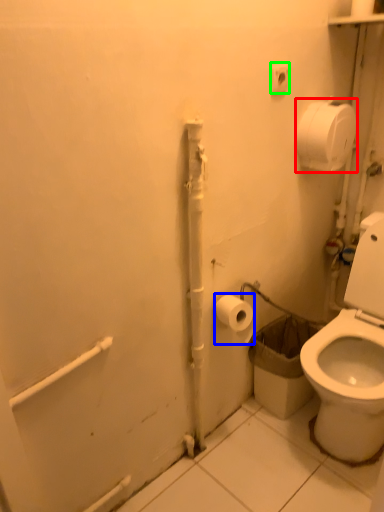
Question: Estimate the real-world distances between objects in this image. Which object is closer to toilet paper (highlighted by a red box), toilet paper (highlighted by a blue box) or electric outlet (highlighted by a green box)?

Choices:
 (A) toilet paper
 (B) electric outlet

Answer: (B)